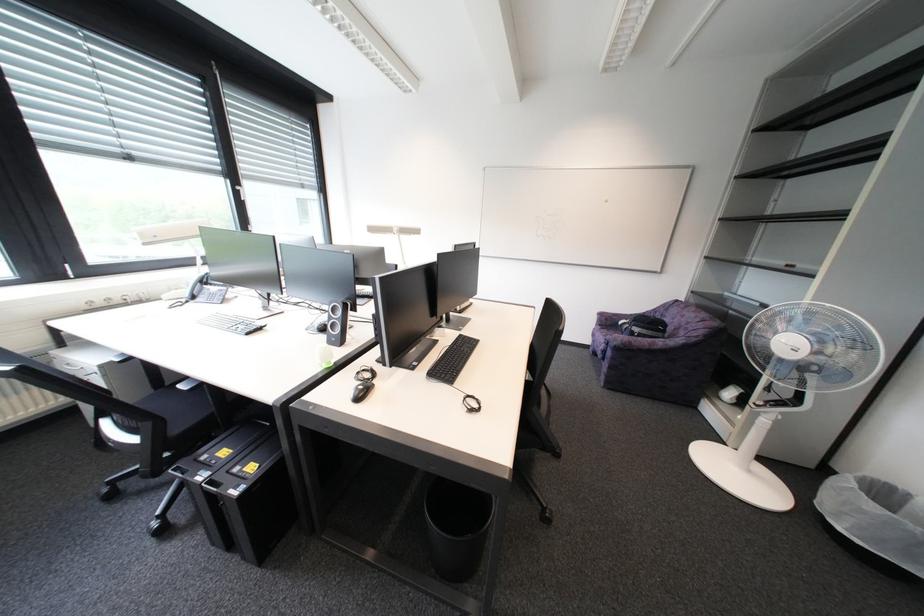
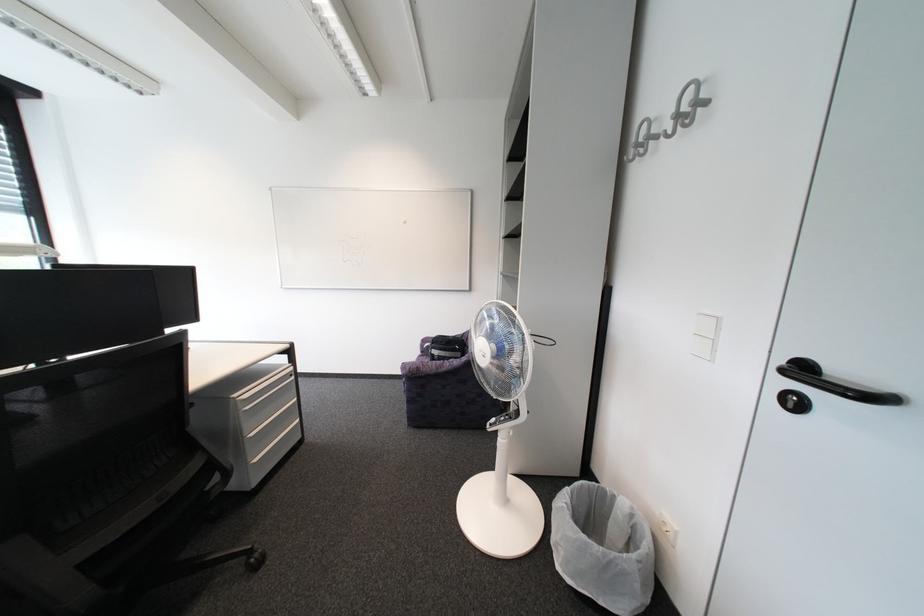
Question: The images are taken continuously from a first-person perspective. In which direction are you moving?

Choices:
 (A) Left
 (B) Right
 (C) Forward
 (D) Backward

Answer: (B)